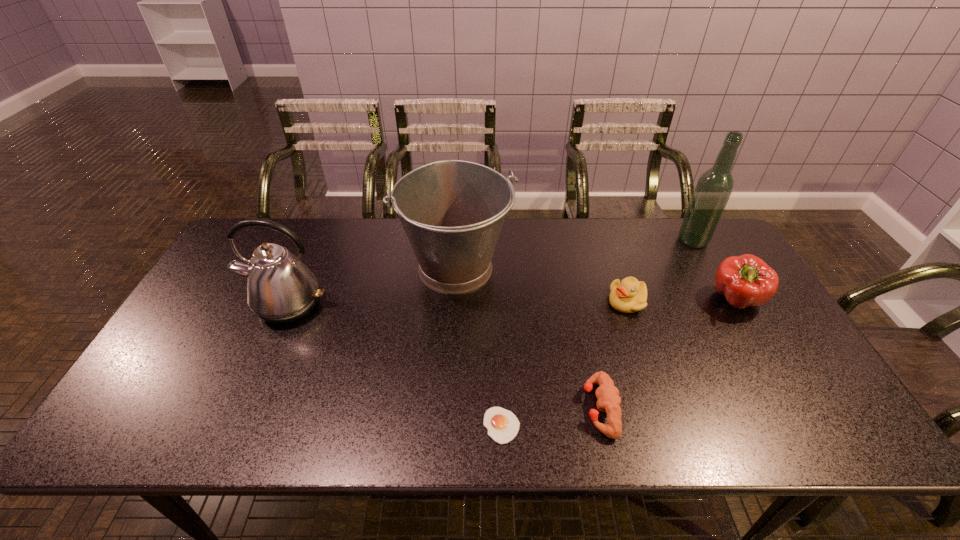
At what (x,y) coordinates should I click in order to perform the action: click on free space located on the right of the bucket. Please return your answer as a coordinate pair (x, y). The image size is (960, 540). Looking at the image, I should click on (632, 267).

The width and height of the screenshot is (960, 540). In order to click on free space located 0.120m from the spout of the kettle in this screenshot , I will do `click(260, 366)`.

What are the coordinates of `free region located on the left of the fourth tallest object` in the screenshot? It's located at (640, 300).

What are the coordinates of `free space located 0.290m on the beak of the duckling` in the screenshot? It's located at (508, 302).

Identify the location of vacant point located 0.360m on the beak of the duckling. (483, 302).

Identify the location of vacant space located on the beak of the duckling. The width and height of the screenshot is (960, 540). (476, 302).

Where is `vacant region located with the gloves of the sixth tallest object facing forward`? This screenshot has width=960, height=540. vacant region located with the gloves of the sixth tallest object facing forward is located at coordinates (480, 408).

Locate an element on the screen. The image size is (960, 540). free space located with the gloves of the sixth tallest object facing forward is located at coordinates (515, 408).

Find the location of a particular element. The width and height of the screenshot is (960, 540). vacant point located with the gloves of the sixth tallest object facing forward is located at coordinates (437, 408).

Where is `free location located 0.320m on the right of the egg yolk`? Image resolution: width=960 pixels, height=540 pixels. free location located 0.320m on the right of the egg yolk is located at coordinates (662, 426).